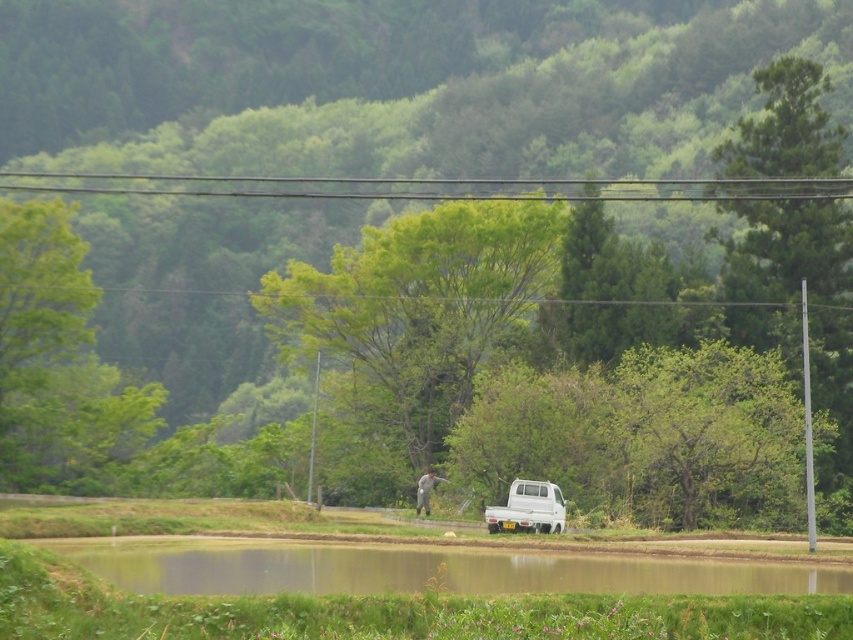
You are a delivery person who needs to tie a package to the roof of the white matte pickup truck at center. The smooth wire at upper center is available. Can you reach the wire from where you are standing next to the truck?

The white matte pickup truck at center is further to the viewer than smooth wire at upper center, so the wire is behind the truck. Since you are standing next to the truck, you cannot reach the smooth wire at upper center because it is located behind the truck and out of your immediate access.

You are standing at the edge of the pond and see the white matte pickup truck at center and the smooth wire at upper center. Which object is closer to your right side?

The smooth wire at upper center is closer to your right side because the white matte pickup truck at center is positioned to the left of it.

You are a photographer planning to take a picture of the green grassy lake at lower center and the smooth wire at upper center. Which object should you focus on first if you want to capture both in a single frame without moving the camera?

You should focus on the green grassy lake at lower center first because it is closer to the camera than the smooth wire at upper center, which is further away.